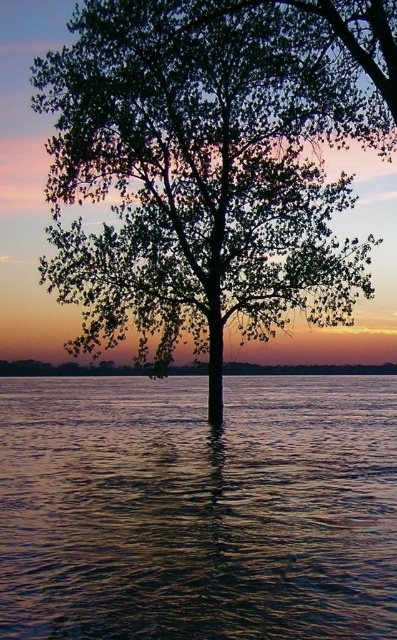
Question: Can you confirm if green leafy tree at center is bigger than translucent water at center?

Choices:
 (A) yes
 (B) no

Answer: (A)

Question: Is green leafy tree at center to the left of translucent water at center from the viewer's perspective?

Choices:
 (A) yes
 (B) no

Answer: (B)

Question: Is green leafy tree at center wider than translucent water at center?

Choices:
 (A) no
 (B) yes

Answer: (A)

Question: Which of the following is the closest to the observer?

Choices:
 (A) (294, 166)
 (B) (275, 442)

Answer: (B)